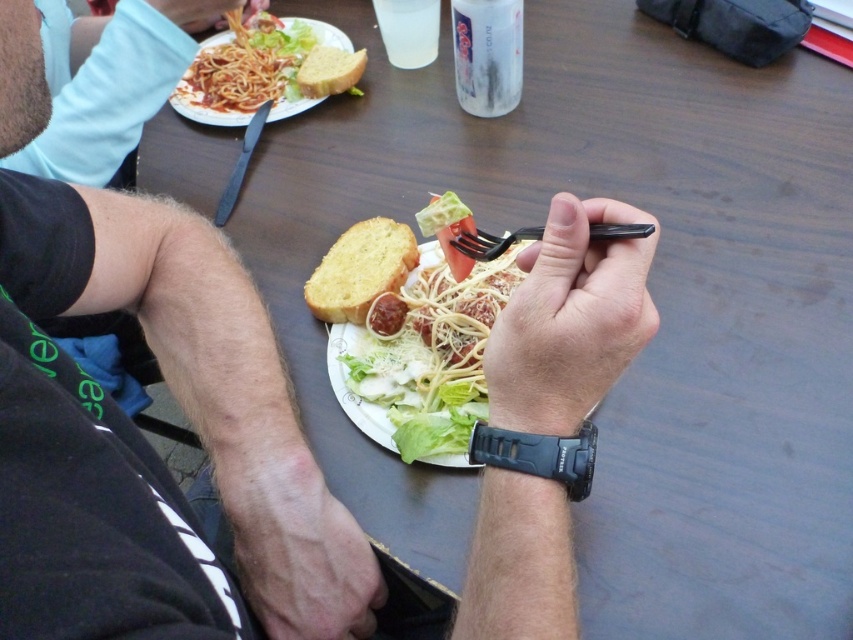
Question: Is white matte spaghetti at center to the right of black plastic fork at center from the viewer's perspective?

Choices:
 (A) yes
 (B) no

Answer: (B)

Question: Which point is closer to the camera?

Choices:
 (A) (358, 67)
 (B) (387, 381)
 (C) (332, 33)

Answer: (B)

Question: Which of the following is the farthest from the observer?

Choices:
 (A) black plastic fork at center
 (B) golden bread at center
 (C) brown toasted bread at upper center

Answer: (C)

Question: Which point is farther from the camera taking this photo?

Choices:
 (A) (639, 324)
 (B) (421, 260)
 (C) (263, 556)

Answer: (B)

Question: Does white matte spaghetti at center have a smaller size compared to black plastic fork at center?

Choices:
 (A) yes
 (B) no

Answer: (B)

Question: Is white matte spaghetti at center to the left of white paper plate at upper left from the viewer's perspective?

Choices:
 (A) no
 (B) yes

Answer: (A)